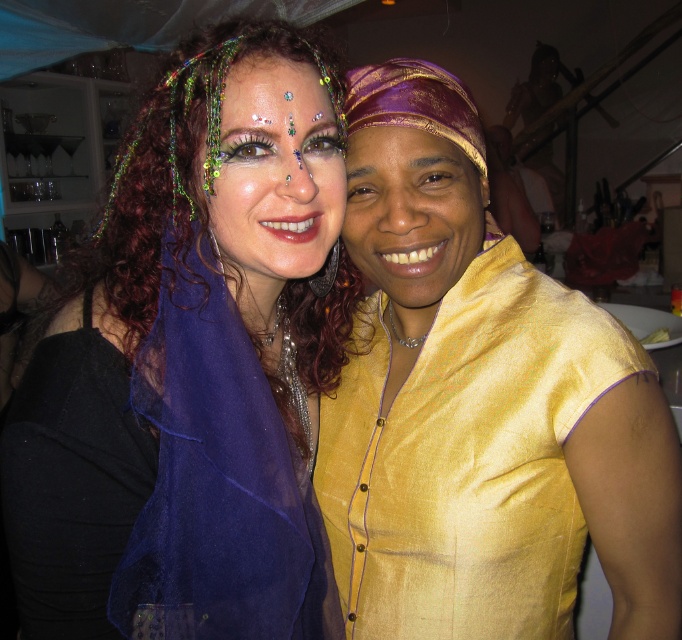
You are a photographer at a fashion show. You need to decide which item to focus on for a closeup shot. The matte black dress at center and the shiny green headband at center are both in frame. Considering their sizes, which one would be better to zoom in on for clarity?

The matte black dress at center is bigger than the shiny green headband at center, so zooming in on the matte black dress at center would provide better clarity as it is larger and more likely to remain in focus.

You are taking a photo of two people at a social event. The camera you are using has a minimum focus distance of 25 inches. You want to ensure that the point at coordinates point (149,321) is in focus. Will the camera be able to focus on that point?

The point point (149,321) is 25.74 inches from the camera, which is just beyond the minimum focus distance of 25 inches. Therefore, the camera should be able to focus on that point.